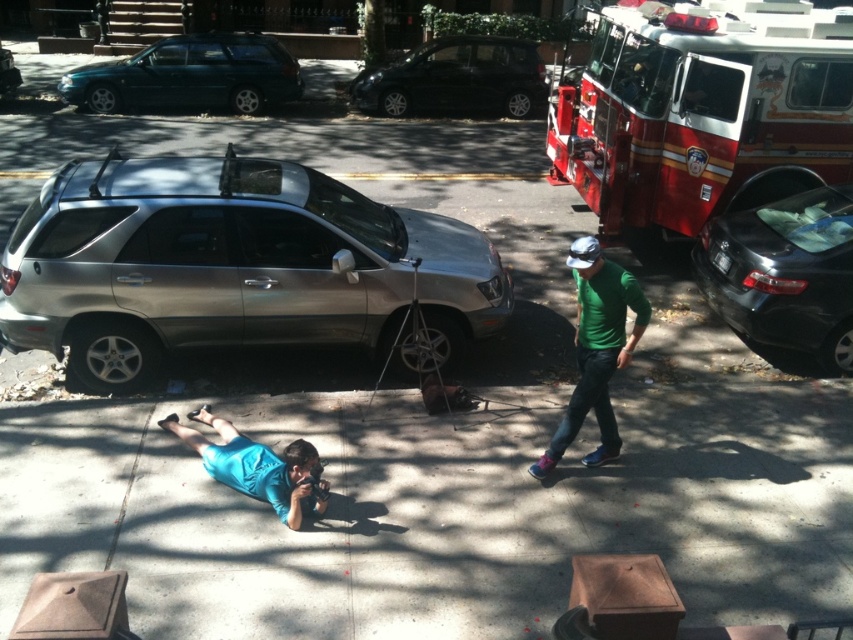
Can you confirm if black matte car at right is positioned above teal matte station wagon at upper left?

No.

Does black matte car at right have a smaller size compared to teal matte station wagon at upper left?

Correct, black matte car at right occupies less space than teal matte station wagon at upper left.

Which is behind, point (828, 204) or point (106, 67)?

The point (106, 67) is behind.

This screenshot has height=640, width=853. Find the location of `black matte car at right`. black matte car at right is located at coordinates (784, 273).

Which is behind, point (753, 202) or point (511, 88)?

Point (511, 88)

Can you confirm if red metallic fire truck at upper right is bigger than shiny black car at center?

Indeed, red metallic fire truck at upper right has a larger size compared to shiny black car at center.

What do you see at coordinates (703, 113) in the screenshot? I see `red metallic fire truck at upper right` at bounding box center [703, 113].

The width and height of the screenshot is (853, 640). In order to click on red metallic fire truck at upper right in this screenshot , I will do `click(703, 113)`.

Which of these two, black matte car at right or metallic silver suv at center, stands shorter?

metallic silver suv at center

Does black matte car at right appear on the right side of metallic silver suv at center?

Correct, you'll find black matte car at right to the right of metallic silver suv at center.

Which is behind, point (730, 269) or point (0, 60)?

Point (0, 60)

At what (x,y) coordinates should I click in order to perform the action: click on black matte car at right. Please return your answer as a coordinate pair (x, y). This screenshot has height=640, width=853. Looking at the image, I should click on (784, 273).